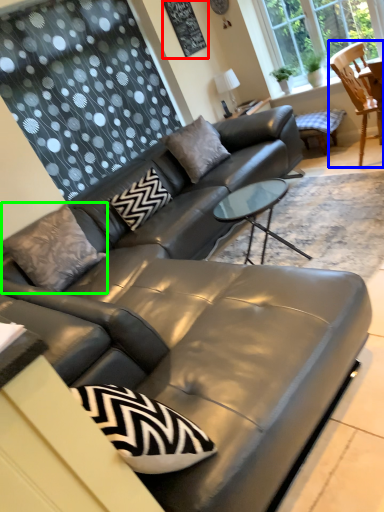
Question: Which object is the farthest from bulletin board (highlighted by a red box)? Choose among these: chair (highlighted by a blue box) or pillow (highlighted by a green box).

Choices:
 (A) chair
 (B) pillow

Answer: (B)